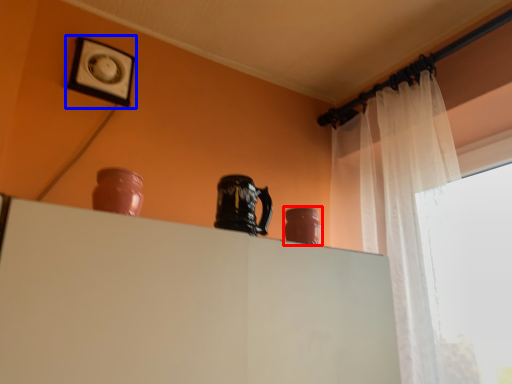
Question: Which point is further to the camera, vase (highlighted by a red box) or picture frame (highlighted by a blue box)?

Choices:
 (A) vase
 (B) picture frame

Answer: (B)